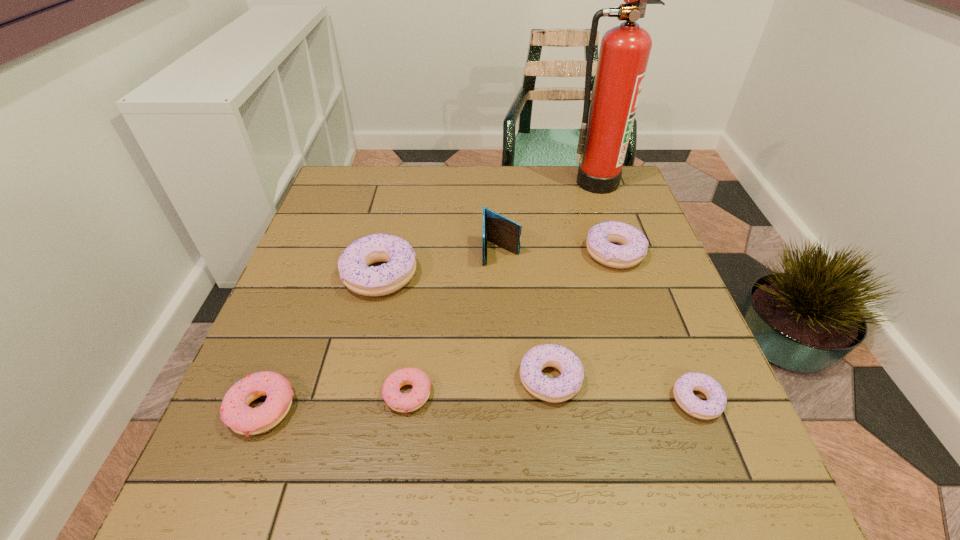
Locate an element on the screen. This screenshot has height=540, width=960. the leftmost doughnut is located at coordinates (235, 412).

Find the location of a particular element. the leftmost object is located at coordinates [235, 412].

Find the location of `the smallest purple doughnut`. the smallest purple doughnut is located at coordinates (683, 389).

The width and height of the screenshot is (960, 540). I want to click on the smaller pink doughnut, so click(x=402, y=402).

Where is `vacant area situated with the nozzle pointing from the back of the farthest object`? vacant area situated with the nozzle pointing from the back of the farthest object is located at coordinates (x=612, y=230).

Identify the location of free space located 0.140m on the exterior surface of the wallet. Image resolution: width=960 pixels, height=540 pixels. pos(504,310).

Find the location of a particular element. blank space located 0.090m on the left of the biggest purple doughnut is located at coordinates (305, 275).

Where is `vacant space situated 0.130m on the back of the third smallest purple doughnut`? vacant space situated 0.130m on the back of the third smallest purple doughnut is located at coordinates (599, 206).

The height and width of the screenshot is (540, 960). I want to click on free space located 0.090m on the front of the second smallest purple doughnut, so click(561, 456).

You are a GUI agent. You are given a task and a screenshot of the screen. Output one action in this format:
    pyautogui.click(x=<x>, y=<y>)
    Task: Click on the vacant area located on the back of the bigger pink doughnut
    The width and height of the screenshot is (960, 540).
    Given the screenshot: What is the action you would take?
    tap(315, 273)